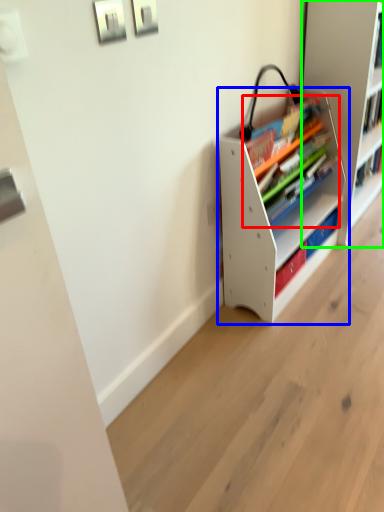
Question: Estimate the real-world distances between objects in this image. Which object is closer to book (highlighted by a red box), shelf (highlighted by a blue box) or shelf (highlighted by a green box)?

Choices:
 (A) shelf
 (B) shelf

Answer: (A)